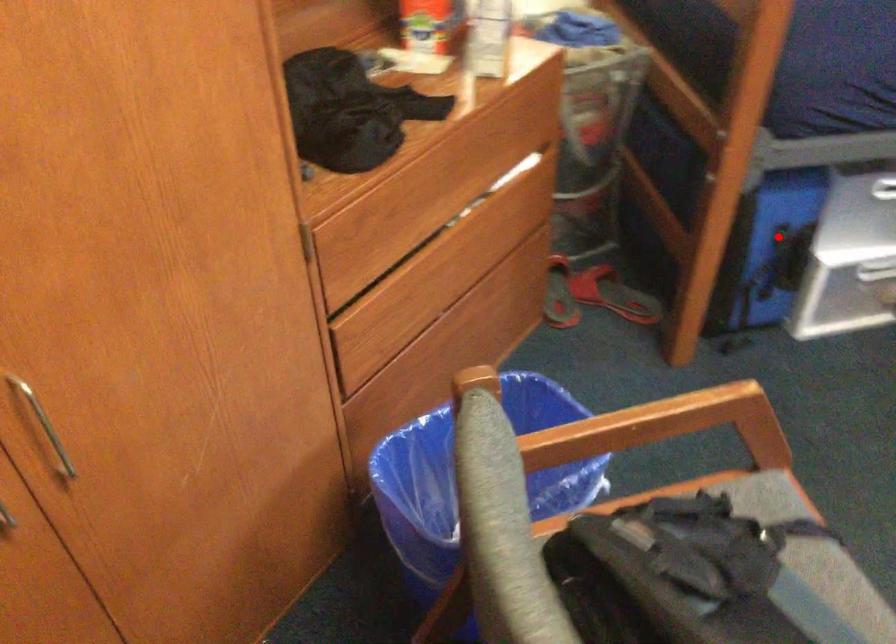
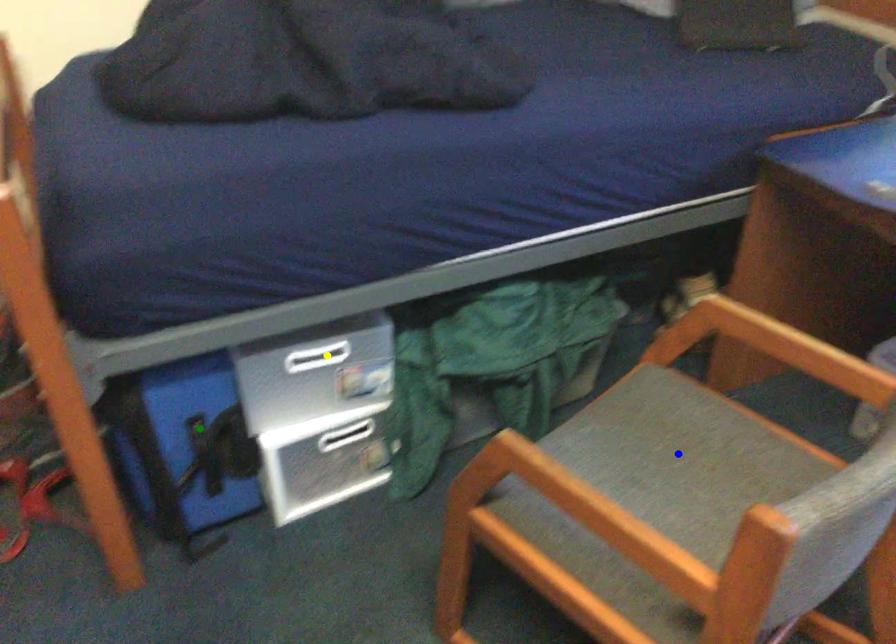
Question: I am providing you with two images of the same scene from different viewpoints. A red point is marked on the first image. You are given multiple points on the second image. Which point in image 2 is actually the same real-world point as the red point in image 1?

Choices:
 (A) green point
 (B) blue point
 (C) yellow point

Answer: (A)